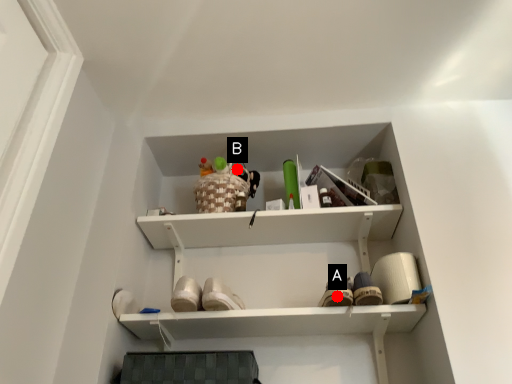
Question: Two points are circled on the image, labeled by A and B beside each circle. Which point is closer to the camera?

Choices:
 (A) A is closer
 (B) B is closer

Answer: (A)